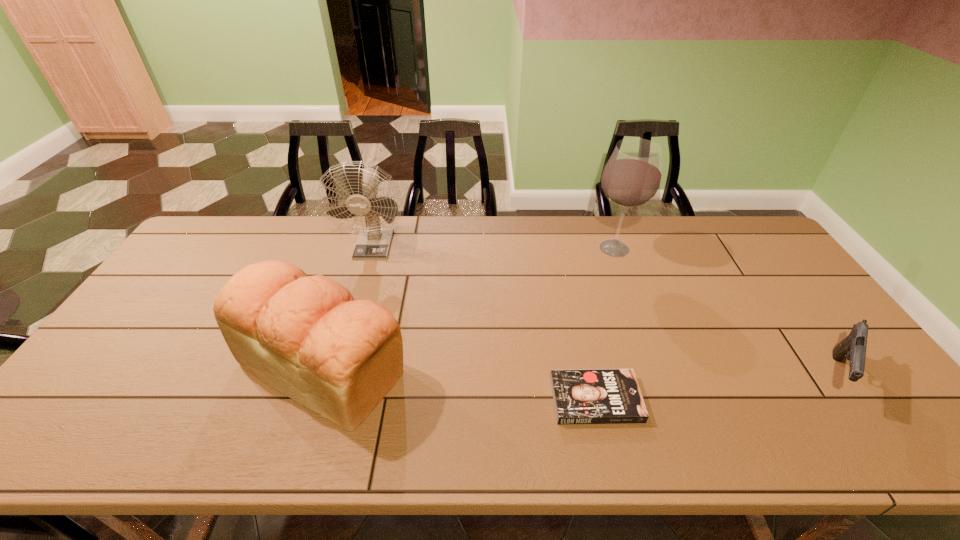
The width and height of the screenshot is (960, 540). I want to click on object identified as the fourth closest to the book, so click(373, 242).

In order to click on vacant point that satisfies the following two spatial constraints: 1. on the air flow direction of the alcohol; 2. on the left side of the fan in this screenshot , I will do `click(373, 248)`.

Where is `vacant region that satisfies the following two spatial constraints: 1. on the air flow direction of the book; 2. on the right side of the fan`? vacant region that satisfies the following two spatial constraints: 1. on the air flow direction of the book; 2. on the right side of the fan is located at coordinates (329, 399).

What are the coordinates of `free spot that satisfies the following two spatial constraints: 1. on the air flow direction of the alcohol; 2. on the left side of the fan` in the screenshot? It's located at (373, 248).